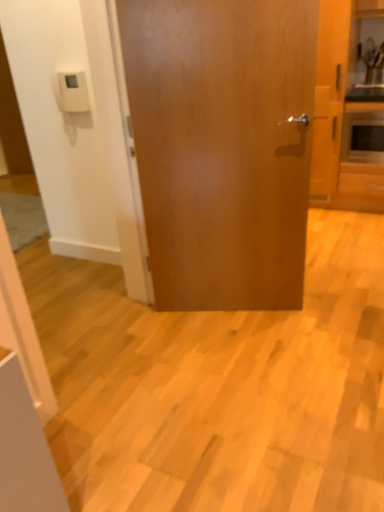
Question: Considering their positions, is matte silver microwave at right located in front of or behind glossy wood door at center?

Choices:
 (A) behind
 (B) front

Answer: (A)

Question: Looking at the image, does matte silver microwave at right seem bigger or smaller compared to glossy wood door at center?

Choices:
 (A) big
 (B) small

Answer: (B)

Question: Considering the real-world distances, which object is farthest from the glossy wood door at center?

Choices:
 (A) matte silver microwave at right
 (B) wooden cabinet at right

Answer: (A)

Question: Estimate the real-world distances between objects in this image. Which object is farther from the wooden cabinet at right?

Choices:
 (A) matte silver microwave at right
 (B) glossy wood door at center

Answer: (B)